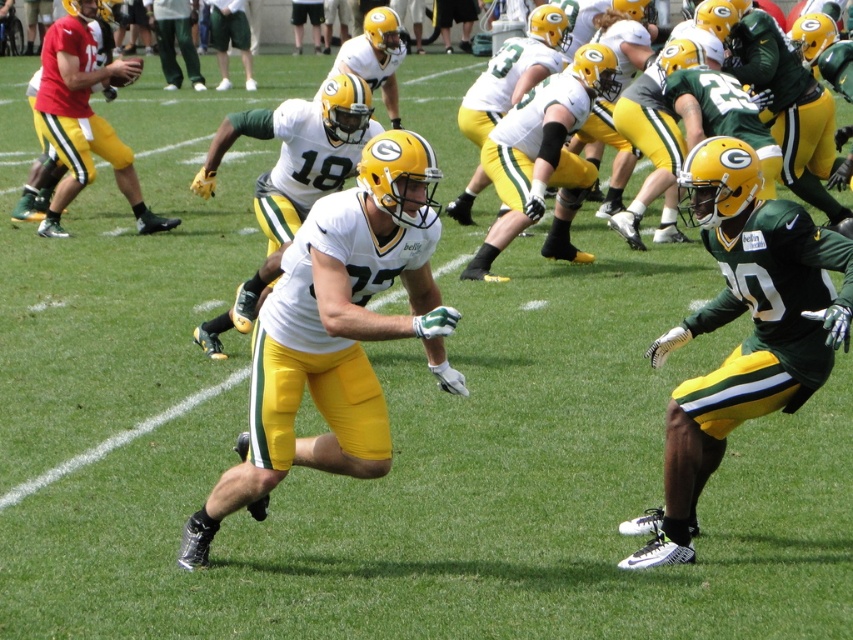
You are a player standing at the point marked by the coordinates (338, 404) on the field. Your coach asks you to sprint directly towards the coach who is standing exactly where the viewer is positioned. How far will you have to run to reach the coach?

The point marked by the coordinates (338, 404) is 5.28 meters away from the viewer, so you will have to run 5.28 meters to reach the coach.

You are a sports analyst watching a football practice. You notice two players on the field. The first is wearing a white matte jersey at center and the second is wearing a matte yellow uniform at left. Based on their uniform sizes, which player do you think is closer to the camera?

The white matte jersey at center has a smaller width compared to the matte yellow uniform at left. Since objects closer to the camera appear larger, this suggests that the matte yellow uniform at left is closer to the camera than the white matte jersey at center.